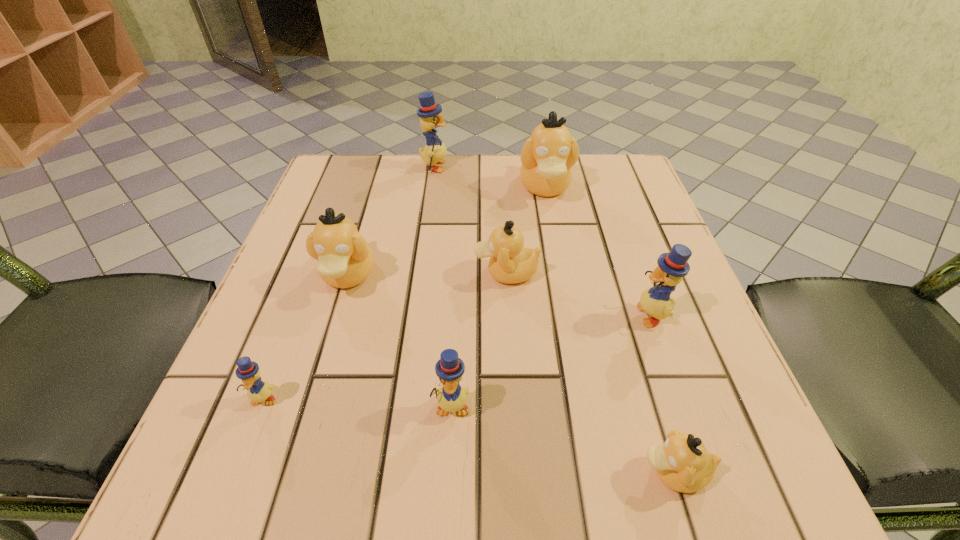
I want to click on the smallest tan duckling, so click(x=682, y=463).

Locate an element on the screen. the leftmost yellow duckling is located at coordinates (259, 390).

The image size is (960, 540). Identify the location of free region located 0.070m on the face of the third yellow duckling from right to left, where the monocle is placed. (477, 167).

This screenshot has height=540, width=960. Identify the location of vacant point located on the face of the biggest tan duckling. (552, 228).

The width and height of the screenshot is (960, 540). Identify the location of free spot located on the face of the rightmost yellow duckling, where the monocle is placed. (576, 314).

Find the location of a particular element. The image size is (960, 540). vacant space positioned on the face of the rightmost yellow duckling, where the monocle is placed is located at coordinates (458, 314).

Find the location of `free location located on the face of the rightmost yellow duckling, where the monocle is placed`. free location located on the face of the rightmost yellow duckling, where the monocle is placed is located at coordinates (605, 314).

The width and height of the screenshot is (960, 540). What are the coordinates of `vacant area situated on the face of the leftmost tan duckling` in the screenshot? It's located at (324, 354).

Find the location of `vacant space situated 0.310m on the face of the third biggest tan duckling`. vacant space situated 0.310m on the face of the third biggest tan duckling is located at coordinates [308, 273].

Where is `vacant space located on the face of the third biggest tan duckling`? vacant space located on the face of the third biggest tan duckling is located at coordinates (367, 273).